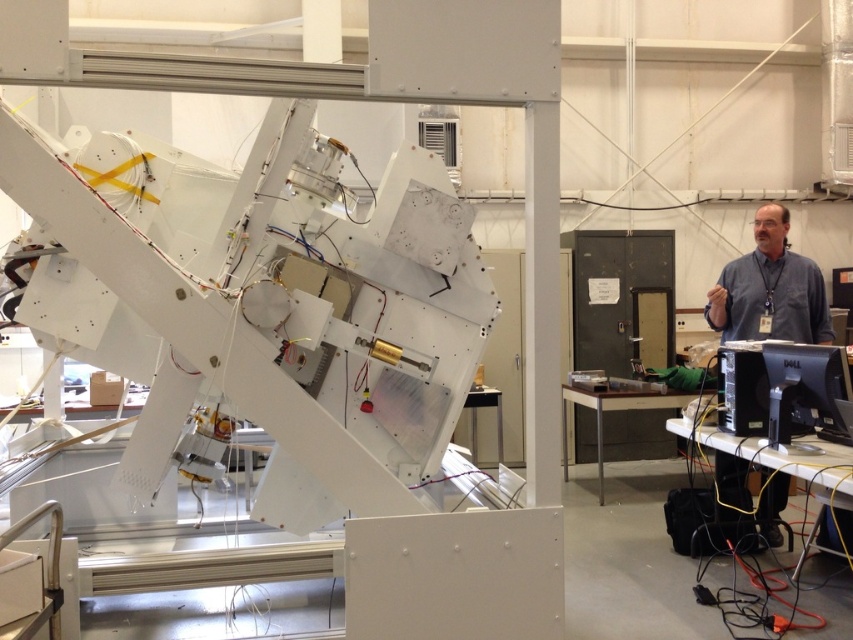
You are an observer in the laboratory and notice two people wearing the gray shirt at right and the blue shirt at right. Which person has a narrower shirt?

The gray shirt at right has a lesser width compared to the blue shirt at right, so the person wearing the gray shirt at right has the narrower shirt.

You are a technician in the lab and need to locate the gray shirt at right. According to the coordinates provided, where exactly is it positioned in the image?

The gray shirt at right is positioned at the coordinates point (x=770, y=289).

You are an engineer in the lab and need to identify the location of two team members wearing different colored shirts. According to the scene, where is the gray shirt at right in relation to the blue shirt at right?

The gray shirt at right is located above the blue shirt at right.